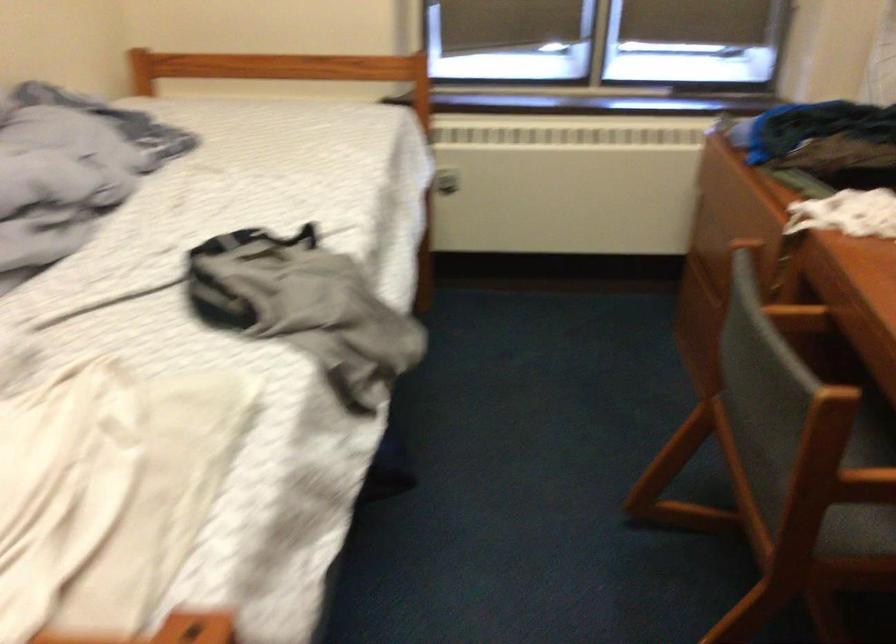
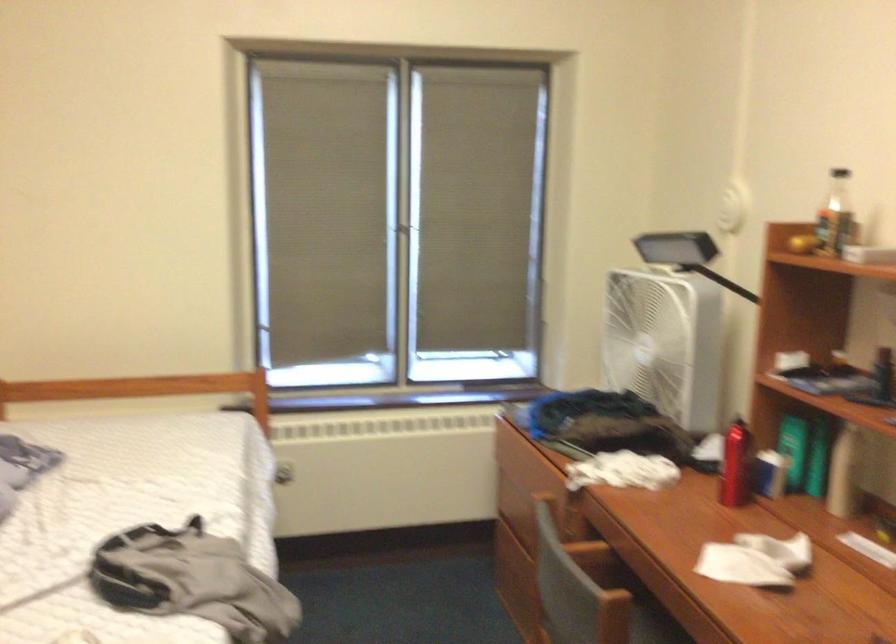
The images are taken continuously from a first-person perspective. In which direction is your viewpoint rotating?

The camera's rotation is toward right-up.